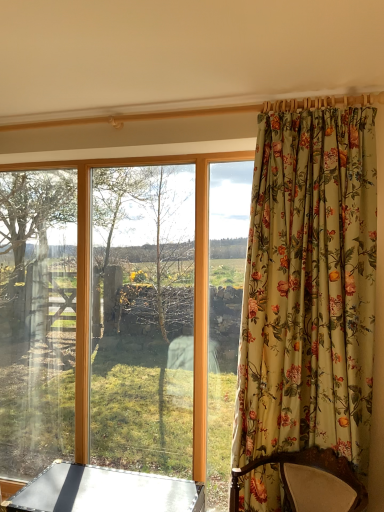
Question: Would you say floral fabric curtain at right is a long distance from metallic silver table at lower left?

Choices:
 (A) no
 (B) yes

Answer: (A)

Question: Is floral fabric curtain at right placed right next to metallic silver table at lower left?

Choices:
 (A) no
 (B) yes

Answer: (A)

Question: Does floral fabric curtain at right have a larger size compared to metallic silver table at lower left?

Choices:
 (A) no
 (B) yes

Answer: (B)

Question: Does floral fabric curtain at right appear on the right side of metallic silver table at lower left?

Choices:
 (A) yes
 (B) no

Answer: (A)

Question: From a real-world perspective, does floral fabric curtain at right stand above metallic silver table at lower left?

Choices:
 (A) yes
 (B) no

Answer: (A)

Question: Do you think transparent glass window at center is within metallic silver table at lower left, or outside of it?

Choices:
 (A) inside
 (B) outside

Answer: (B)

Question: From the image's perspective, is transparent glass window at center located above or below metallic silver table at lower left?

Choices:
 (A) below
 (B) above

Answer: (B)

Question: Considering the positions of point (168, 160) and point (160, 478), is point (168, 160) closer or farther from the camera than point (160, 478)?

Choices:
 (A) closer
 (B) farther

Answer: (B)

Question: In the image, is transparent glass window at center on the left side or the right side of metallic silver table at lower left?

Choices:
 (A) right
 (B) left

Answer: (B)

Question: From the image's perspective, is metallic silver table at lower left above or below floral fabric curtain at right?

Choices:
 (A) above
 (B) below

Answer: (B)

Question: Would you say metallic silver table at lower left is inside or outside floral fabric curtain at right?

Choices:
 (A) outside
 (B) inside

Answer: (A)

Question: Is metallic silver table at lower left to the left or to the right of floral fabric curtain at right in the image?

Choices:
 (A) left
 (B) right

Answer: (A)

Question: Is point (72, 464) closer or farther from the camera than point (297, 365)?

Choices:
 (A) closer
 (B) farther

Answer: (B)

Question: Would you say transparent glass window at center is to the left or to the right of floral fabric curtain at right in the picture?

Choices:
 (A) left
 (B) right

Answer: (A)

Question: Do you think transparent glass window at center is within floral fabric curtain at right, or outside of it?

Choices:
 (A) outside
 (B) inside

Answer: (A)